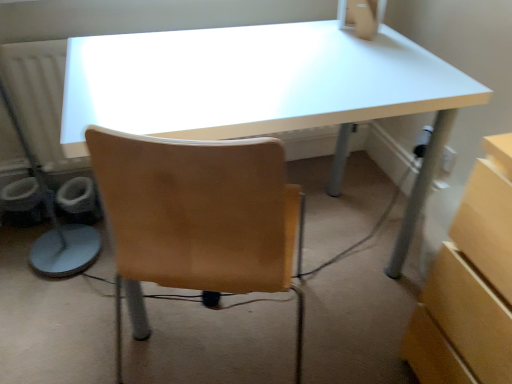
Where is `vacant point above white glossy desk at center (from a real-world perspective)`? Image resolution: width=512 pixels, height=384 pixels. vacant point above white glossy desk at center (from a real-world perspective) is located at coordinates (243, 72).